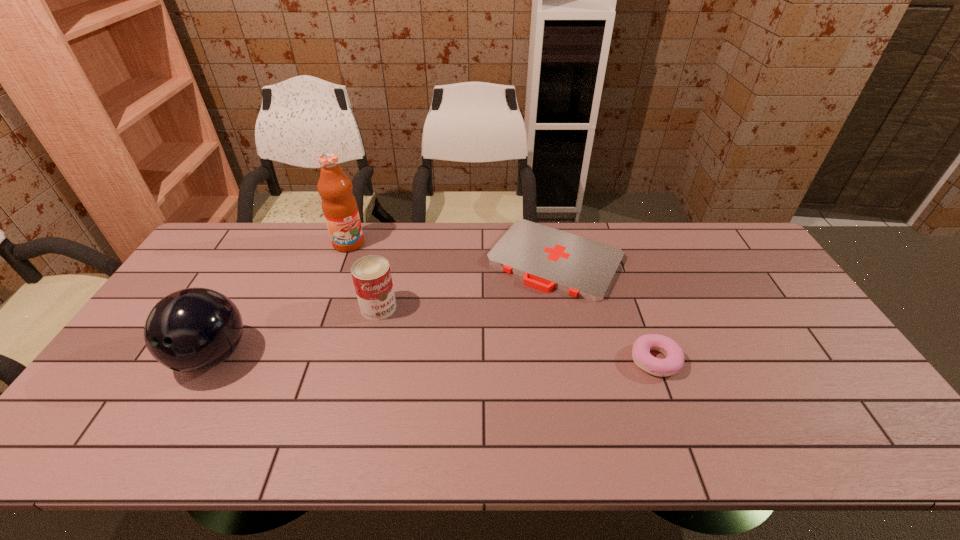
The width and height of the screenshot is (960, 540). I want to click on free space located 0.120m on handle side the shortest object, so click(509, 322).

In order to click on free space located 0.370m on handle side the shortest object in this screenshot , I will do `click(466, 388)`.

This screenshot has height=540, width=960. Find the location of `free location located 0.270m on handle side the shortest object`. free location located 0.270m on handle side the shortest object is located at coordinates (484, 359).

Where is `blank area located on the front label of the fruit juice`? The image size is (960, 540). blank area located on the front label of the fruit juice is located at coordinates (371, 281).

In order to click on vacant point located on the front label of the fruit juice in this screenshot , I will do `click(358, 260)`.

The width and height of the screenshot is (960, 540). I want to click on blank space located on the front label of the fruit juice, so click(363, 267).

The image size is (960, 540). I want to click on free region located 0.200m on the front label of the can, so click(414, 368).

At what (x,y) coordinates should I click in order to perform the action: click on vacant space situated on the front label of the can. Please return your answer as a coordinate pair (x, y). This screenshot has width=960, height=540. Looking at the image, I should click on (427, 390).

You are a GUI agent. You are given a task and a screenshot of the screen. Output one action in this format:
    pyautogui.click(x=<x>, y=<y>)
    Task: Click on the vacant area situated on the front label of the can
    
    Given the screenshot: What is the action you would take?
    pyautogui.click(x=412, y=365)

You are a GUI agent. You are given a task and a screenshot of the screen. Output one action in this format:
    pyautogui.click(x=<x>, y=<y>)
    Task: Click on the first-aid kit situated at the far edge
    
    Given the screenshot: What is the action you would take?
    pyautogui.click(x=548, y=258)